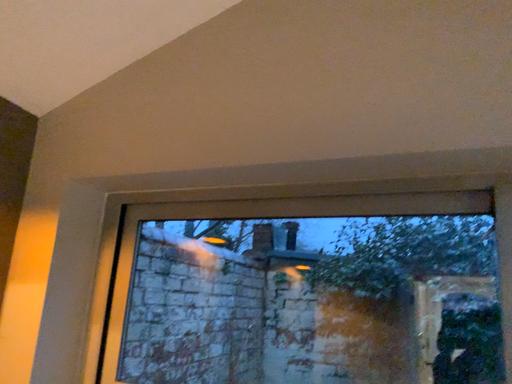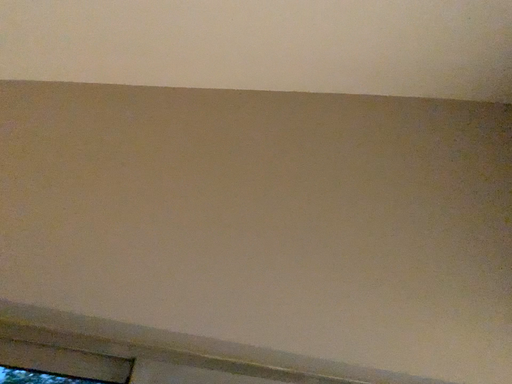
Question: Which way did the camera rotate in the video?

Choices:
 (A) rotated downward
 (B) rotated upward

Answer: (B)